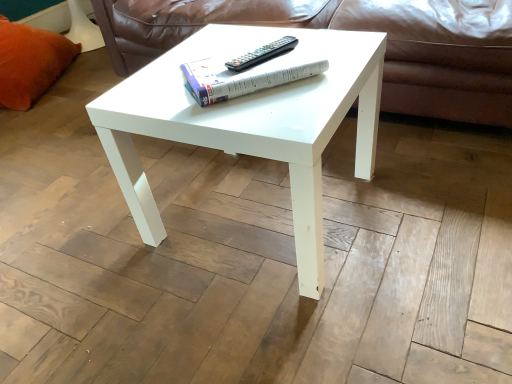
Where is `vacant region below white paper at center (from a real-world perspective)`? This screenshot has width=512, height=384. vacant region below white paper at center (from a real-world perspective) is located at coordinates (241, 63).